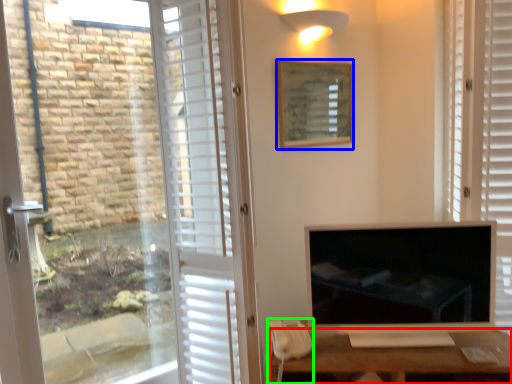
Question: Considering the real-world distances, which object is farthest from desk (highlighted by a red box)? picture frame (highlighted by a blue box) or corded phone (highlighted by a green box)?

Choices:
 (A) picture frame
 (B) corded phone

Answer: (A)